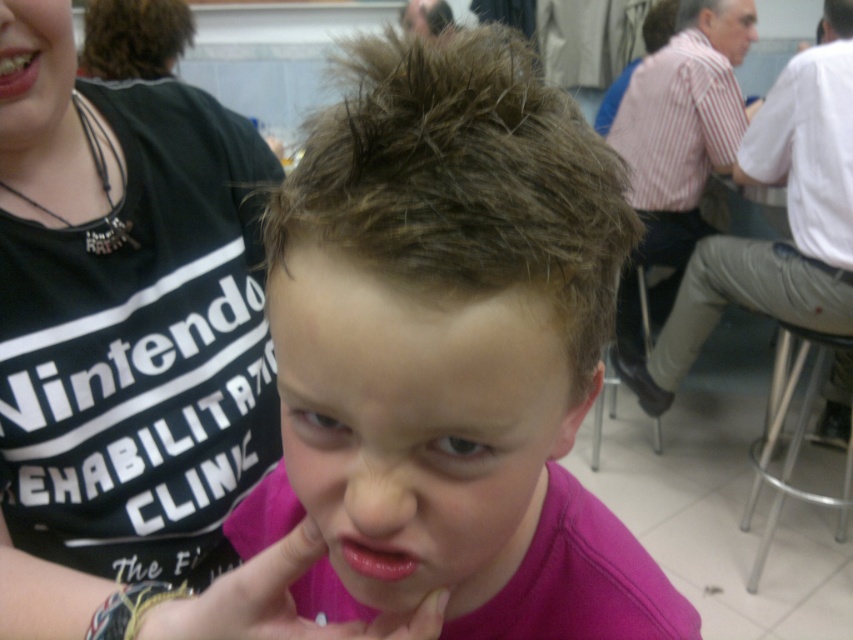
You are designing a poster for a childrens clothing brand and need to place the pink matte skin at center and the silver metallic stool at lower right. Which object should you make larger in size to emphasize the child?

To emphasize the child, you should make the pink matte skin at center larger since its current width is smaller than the silver metallic stool at lower right, so increasing its size would draw more attention to the child.

You are a dentist examining a patient and notice two teeth in the upper left quadrant of their mouth. The patient mentions they can see both teethsmoothtooth at upper left and teeth glossy at upper left when they look in the mirror. Which tooth is closer to the front of their mouth?

The teethsmoothtooth at upper left is closer to the front of the mouth because it is positioned in front of teeth glossy at upper left.

You are standing at the origin point in the image. Which of the two points, point (20,128) or point (6,81), is farther away from you?

Point (20,128) is farther away from you because it is behind point (6,81).